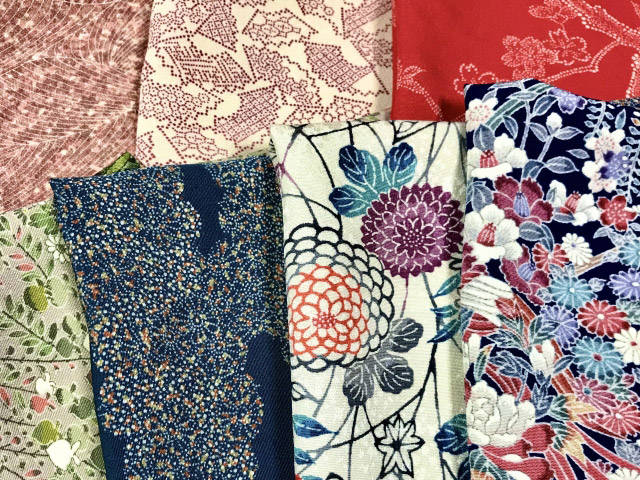
Identify the location of corners. This screenshot has height=480, width=640. (614, 462), (15, 468), (15, 15), (624, 13).